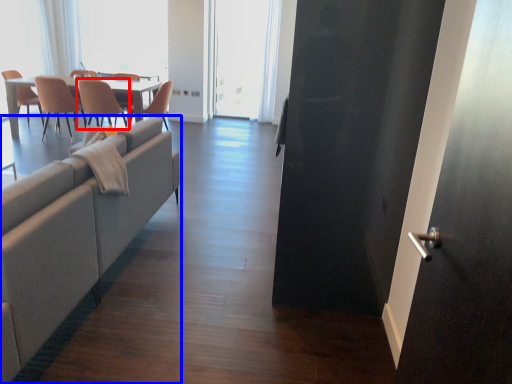
Question: Which point is closer to the camera, chair (highlighted by a red box) or studio couch (highlighted by a blue box)?

Choices:
 (A) chair
 (B) studio couch

Answer: (B)